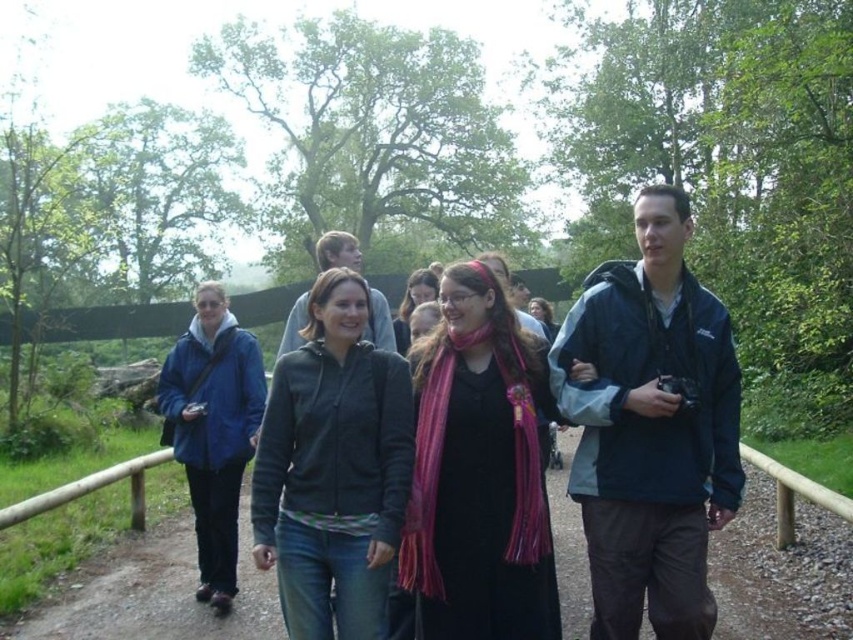
You are standing at the point with coordinates point (x=312, y=458) and want to walk towards the point with coordinates point (x=724, y=433). Are you moving forward or backward?

Since point (x=724, y=433) is behind point (x=312, y=458), moving towards it would mean you are moving backward.